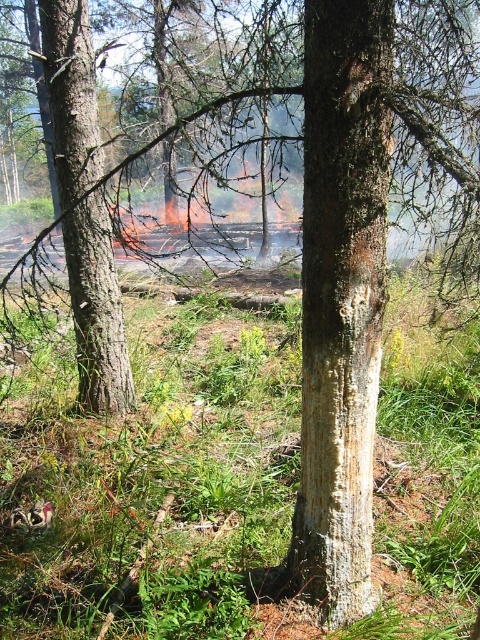
You are a firefighter trying to reach the fire line in the background. You are currently standing at the smooth brown tree trunk at center. What direction should you move to reach the fire line?

The smooth brown tree trunk at center is located at point (342,298). Since the fire line is in the background, you should move forward from the smooth brown tree trunk at center to reach it.

You are a firefighter assessing the area between the smooth brown tree trunk at center and the smooth brown tree trunk at left. You have a fire barrier that is 1.5 meters wide. Can you place it between them to block the fire spread?

The distance between the smooth brown tree trunk at center and smooth brown tree trunk at left is 1.63 meters. Since the fire barrier is 1.5 meters wide, it can be placed between them with some space remaining, effectively blocking the fire spread.